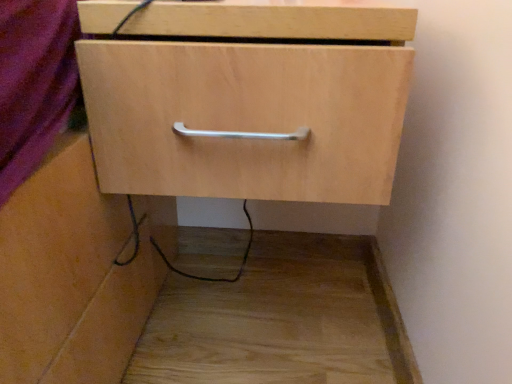
This screenshot has height=384, width=512. Find the location of `natural wood drawer at center`. natural wood drawer at center is located at coordinates (246, 118).

This screenshot has height=384, width=512. What do you see at coordinates (246, 118) in the screenshot? I see `natural wood drawer at center` at bounding box center [246, 118].

Identify the location of natural wood drawer at center. This screenshot has height=384, width=512. (246, 118).